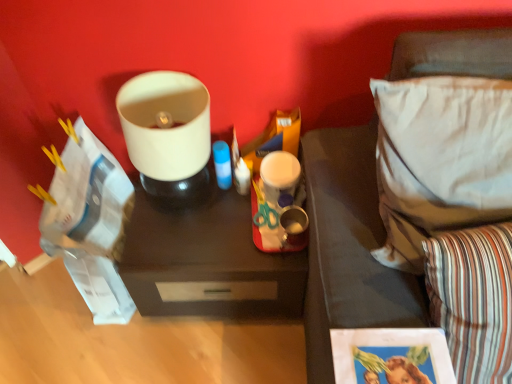
This screenshot has height=384, width=512. Find the location of `white fabric pillow at right, the first pillow viewed from the top`. white fabric pillow at right, the first pillow viewed from the top is located at coordinates (445, 149).

Describe the element at coordinates (167, 132) in the screenshot. I see `matte white lampshade at upper center` at that location.

The image size is (512, 384). What are the coordinates of `white fabric pillow at right, the 2th pillow in the bottom-to-top sequence` in the screenshot? It's located at (445, 149).

From a real-world perspective, which is physically below, matte white lampshade at upper center or striped fabric pillow at lower right, the second pillow in the top-to-bottom sequence?

In real-world perspective, matte white lampshade at upper center is lower.

Does matte white lampshade at upper center have a larger size compared to striped fabric pillow at lower right, arranged as the 1th pillow when ordered from the bottom?

No.

How many degrees apart are the facing directions of matte white lampshade at upper center and striped fabric pillow at lower right, arranged as the 1th pillow when ordered from the bottom?

The angular difference between matte white lampshade at upper center and striped fabric pillow at lower right, arranged as the 1th pillow when ordered from the bottom, is 11.6 degrees.

Can you see dark wood tray at center touching matte white lampshade at upper center?

dark wood tray at center and matte white lampshade at upper center are clearly separated.

Is dark wood tray at center bigger than matte white lampshade at upper center?

Indeed, dark wood tray at center has a larger size compared to matte white lampshade at upper center.

Which is further, (x=197, y=258) or (x=134, y=89)?

Point (x=197, y=258)

Is dark wood tray at center closer to the viewer compared to matte white lampshade at upper center?

No, it is not.

From a real-world perspective, which is physically above, white fabric pillow at right, the first pillow viewed from the top, or dark wood tray at center?

In real-world perspective, white fabric pillow at right, the first pillow viewed from the top, is above.

From the picture: Which of these two, white fabric pillow at right, the 2th pillow in the bottom-to-top sequence, or dark wood tray at center, is thinner?

white fabric pillow at right, the 2th pillow in the bottom-to-top sequence.

Which of these two, white fabric pillow at right, the first pillow viewed from the top, or dark wood tray at center, stands shorter?

white fabric pillow at right, the first pillow viewed from the top.

Who is more distant, white fabric pillow at right, the first pillow viewed from the top, or dark wood tray at center?

dark wood tray at center.

From a real-world perspective, who is located higher, matte white lampshade at upper center or white fabric pillow at right, the 2th pillow in the bottom-to-top sequence?

white fabric pillow at right, the 2th pillow in the bottom-to-top sequence, is physically above.

Considering the points (149, 175) and (422, 189), which point is behind, point (149, 175) or point (422, 189)?

The point (149, 175) is farther from the camera.

Which object is wider, matte white lampshade at upper center or white fabric pillow at right, the first pillow viewed from the top?

white fabric pillow at right, the first pillow viewed from the top, is wider.

How far apart are matte white lampshade at upper center and white fabric pillow at right, the first pillow viewed from the top?

They are 21.58 inches apart.

From the image's perspective, is striped fabric pillow at lower right, the second pillow in the top-to-bottom sequence, above white fabric pillow at right, the first pillow viewed from the top?

No, from the image's perspective, striped fabric pillow at lower right, the second pillow in the top-to-bottom sequence, is not on top of white fabric pillow at right, the first pillow viewed from the top.

Is striped fabric pillow at lower right, the second pillow in the top-to-bottom sequence, thinner than white fabric pillow at right, the 2th pillow in the bottom-to-top sequence?

Indeed, striped fabric pillow at lower right, the second pillow in the top-to-bottom sequence, has a lesser width compared to white fabric pillow at right, the 2th pillow in the bottom-to-top sequence.

From a real-world perspective, is striped fabric pillow at lower right, arranged as the 1th pillow when ordered from the bottom, on white fabric pillow at right, the first pillow viewed from the top?

No, from a real-world perspective, striped fabric pillow at lower right, arranged as the 1th pillow when ordered from the bottom, is not over white fabric pillow at right, the first pillow viewed from the top

Is striped fabric pillow at lower right, the second pillow in the top-to-bottom sequence, oriented away from white fabric pillow at right, the 2th pillow in the bottom-to-top sequence?

That's right, striped fabric pillow at lower right, the second pillow in the top-to-bottom sequence, is facing away from white fabric pillow at right, the 2th pillow in the bottom-to-top sequence.

This screenshot has height=384, width=512. I want to click on the 2nd pillow in front of the dark wood tray at center, starting your count from the anchor, so click(473, 299).

Which is in front, striped fabric pillow at lower right, the second pillow in the top-to-bottom sequence, or dark wood tray at center?

striped fabric pillow at lower right, the second pillow in the top-to-bottom sequence, is more forward.

From a real-world perspective, who is located lower, striped fabric pillow at lower right, the second pillow in the top-to-bottom sequence, or dark wood tray at center?

dark wood tray at center is physically lower.

Looking at this image, from the image's perspective, is striped fabric pillow at lower right, arranged as the 1th pillow when ordered from the bottom, located above dark wood tray at center?

No.

Looking at this image, is dark wood tray at center not close to striped fabric pillow at lower right, arranged as the 1th pillow when ordered from the bottom?

No.

Can you confirm if dark wood tray at center is shorter than striped fabric pillow at lower right, arranged as the 1th pillow when ordered from the bottom?

Incorrect, the height of dark wood tray at center does not fall short of that of striped fabric pillow at lower right, arranged as the 1th pillow when ordered from the bottom.

Based on the photo, between dark wood tray at center and striped fabric pillow at lower right, the second pillow in the top-to-bottom sequence, which one has larger width?

dark wood tray at center.

From the image's perspective, is dark wood tray at center located above striped fabric pillow at lower right, arranged as the 1th pillow when ordered from the bottom?

Yes.

The height and width of the screenshot is (384, 512). What are the coordinates of `appliance behind the striped fabric pillow at lower right, the second pillow in the top-to-bottom sequence` in the screenshot? It's located at (167, 132).

Locate an element on the screen. appliance that appears on the left of dark wood tray at center is located at coordinates pyautogui.click(x=167, y=132).

Based on their spatial positions, is dark wood tray at center or striped fabric pillow at lower right, the second pillow in the top-to-bottom sequence, further from white fabric pillow at right, the 2th pillow in the bottom-to-top sequence?

dark wood tray at center.

Considering their positions, is striped fabric pillow at lower right, the second pillow in the top-to-bottom sequence, positioned further to white fabric pillow at right, the 2th pillow in the bottom-to-top sequence, than dark wood tray at center?

dark wood tray at center is further to white fabric pillow at right, the 2th pillow in the bottom-to-top sequence.

Estimate the real-world distances between objects in this image. Which object is further from white fabric pillow at right, the 2th pillow in the bottom-to-top sequence, striped fabric pillow at lower right, the second pillow in the top-to-bottom sequence, or matte white lampshade at upper center?

matte white lampshade at upper center is positioned further to the anchor white fabric pillow at right, the 2th pillow in the bottom-to-top sequence.

Which object lies nearer to the anchor point matte white lampshade at upper center, white fabric pillow at right, the first pillow viewed from the top, or dark wood tray at center?

Based on the image, dark wood tray at center appears to be nearer to matte white lampshade at upper center.

Considering their positions, is white fabric pillow at right, the 2th pillow in the bottom-to-top sequence, positioned further to matte white lampshade at upper center than striped fabric pillow at lower right, arranged as the 1th pillow when ordered from the bottom?

striped fabric pillow at lower right, arranged as the 1th pillow when ordered from the bottom, is positioned further to the anchor matte white lampshade at upper center.

From the image, which object appears to be nearer to striped fabric pillow at lower right, arranged as the 1th pillow when ordered from the bottom, matte white lampshade at upper center or dark wood tray at center?

Among the two, dark wood tray at center is located nearer to striped fabric pillow at lower right, arranged as the 1th pillow when ordered from the bottom.

When comparing their distances from dark wood tray at center, does striped fabric pillow at lower right, arranged as the 1th pillow when ordered from the bottom, or matte white lampshade at upper center seem further?

The object further to dark wood tray at center is striped fabric pillow at lower right, arranged as the 1th pillow when ordered from the bottom.

When comparing their distances from striped fabric pillow at lower right, arranged as the 1th pillow when ordered from the bottom, does white fabric pillow at right, the first pillow viewed from the top, or matte white lampshade at upper center seem further?

matte white lampshade at upper center is positioned further to the anchor striped fabric pillow at lower right, arranged as the 1th pillow when ordered from the bottom.

Identify the location of pillow between matte white lampshade at upper center and striped fabric pillow at lower right, the second pillow in the top-to-bottom sequence. (445, 149).

Locate an element on the screen. The height and width of the screenshot is (384, 512). pillow between striped fabric pillow at lower right, the second pillow in the top-to-bottom sequence, and dark wood tray at center from front to back is located at coordinates (445, 149).

Identify the location of table between matte white lampshade at upper center and striped fabric pillow at lower right, the second pillow in the top-to-bottom sequence, in the horizontal direction. The image size is (512, 384). (206, 259).

Image resolution: width=512 pixels, height=384 pixels. I want to click on table between matte white lampshade at upper center and white fabric pillow at right, the first pillow viewed from the top, in the horizontal direction, so click(x=206, y=259).